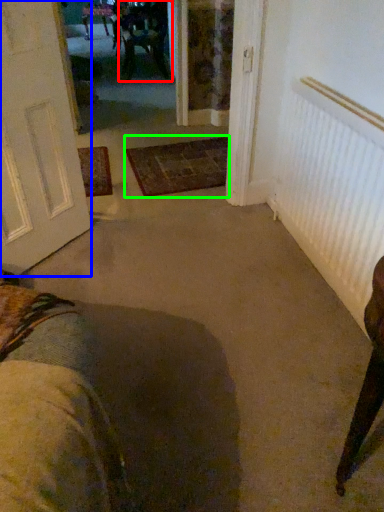
Question: Estimate the real-world distances between objects in this image. Which object is farther from chair (highlighted by a red box), door (highlighted by a blue box) or doormat (highlighted by a green box)?

Choices:
 (A) door
 (B) doormat

Answer: (A)